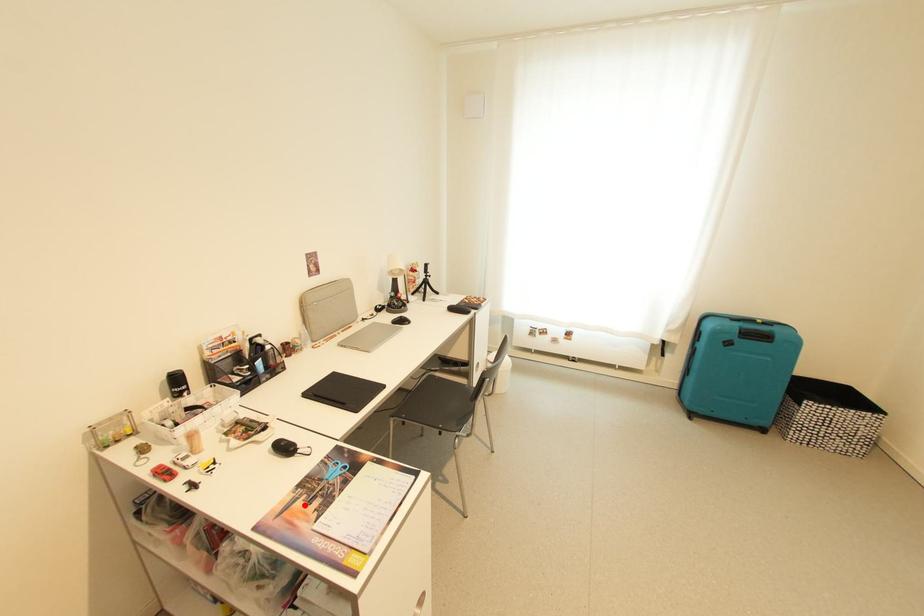
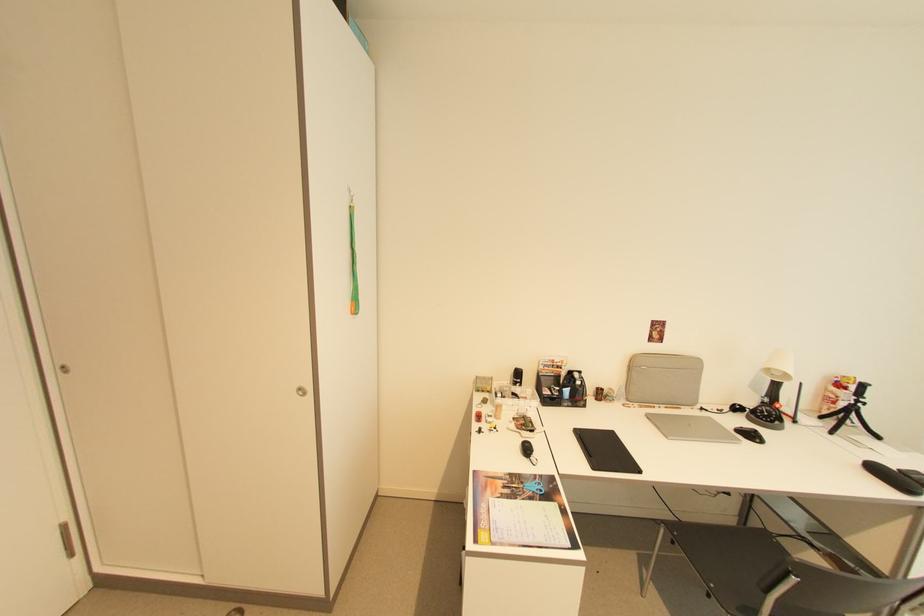
Where in the second image is the point corresponding to the highlighted location from the first image?

(505, 484)